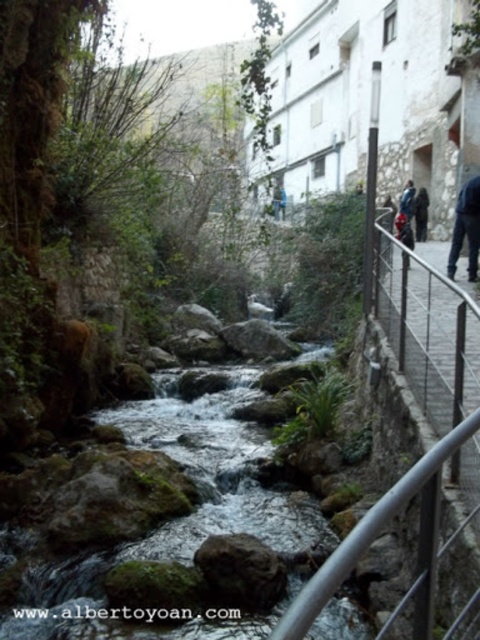
Consider the image. You are a hiker who wants to cross the stream using the pathway on the right. However, you notice the dark blue jeans at right and the blue fabric jacket at upper center in the scene. Which item is closer to the stream?

The dark blue jeans at right is positioned under the blue fabric jacket at upper center, meaning it is closer to the stream.

You are standing on the pathway near the dark blue jeans at right and want to place the blue fabric jacket at upper center on the ground. Can you determine if there is enough space to place the jacket without overlapping the jeans?

The dark blue jeans at right occupies less space than blue fabric jacket at upper center. Therefore, the jacket may require more space than the jeans currently take up, so placing it without overlapping might be challenging unless there is additional room available.